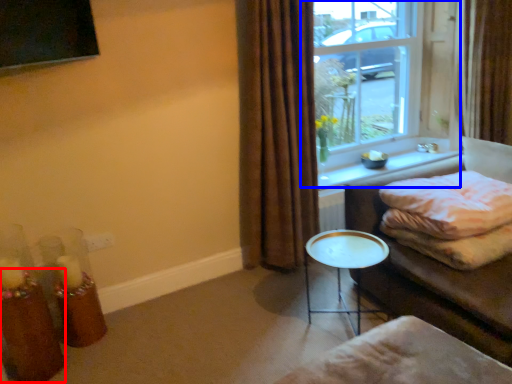
Question: Which object is further to the camera taking this photo, candle holder (highlighted by a red box) or window (highlighted by a blue box)?

Choices:
 (A) candle holder
 (B) window

Answer: (B)